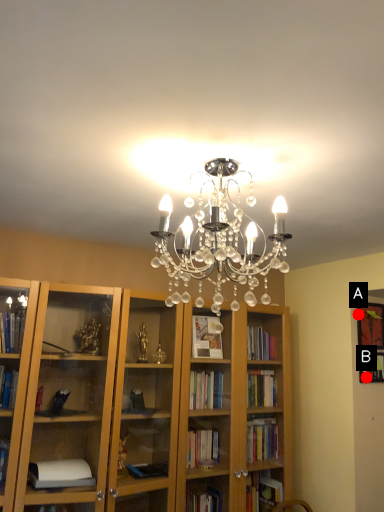
Question: Two points are circled on the image, labeled by A and B beside each circle. Among these points, which one is nearest to the camera?

Choices:
 (A) A is closer
 (B) B is closer

Answer: (B)